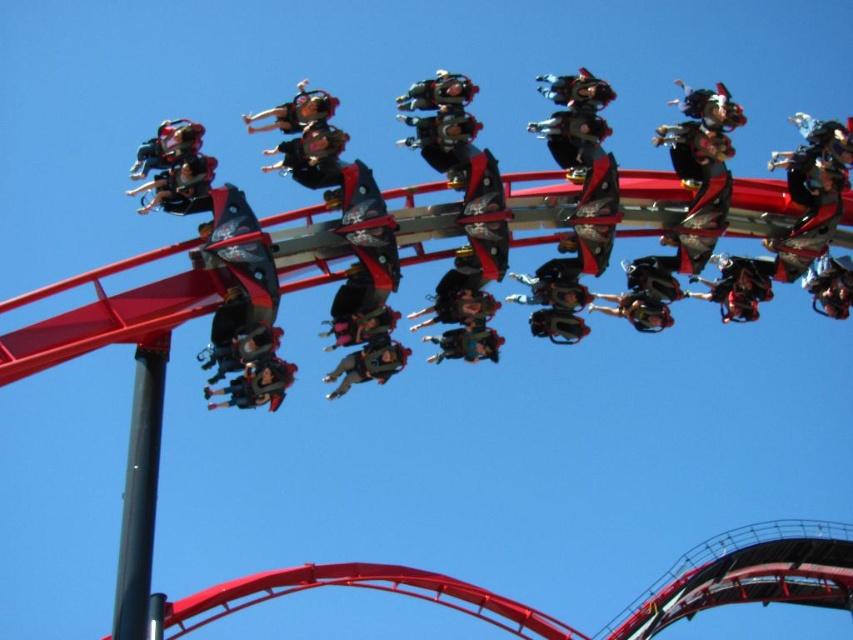
You are standing at the entrance of the amusement park and see the roller coaster track with two points marked as point 1 at coordinates (x=360, y=376) and point 2 at coordinates (x=287, y=104). Which point is closer to you?

Point (x=360, y=376) is closer to the viewer than point (x=287, y=104).

You are a photographer standing at the camera position. You want to capture a closeup shot of the matte black seats at center. Given that your telephoto lens has a maximum effective focal length of 100 meters, will you be able to achieve this closeup without moving closer?

The matte black seats at center is 72.73 meters from camera. Since the telephoto lens can reach up to 100 meters, you can achieve the closeup without moving closer.

Looking at this image, you are an amusement park safety inspector checking the helmets on the roller coaster. You notice two matte black helmets in the scene. Which helmet, the matte black helmet at center or the matte black helmet at upper left, has a larger width according to the description?

The matte black helmet at center might be wider than matte black helmet at upper left according to the description.